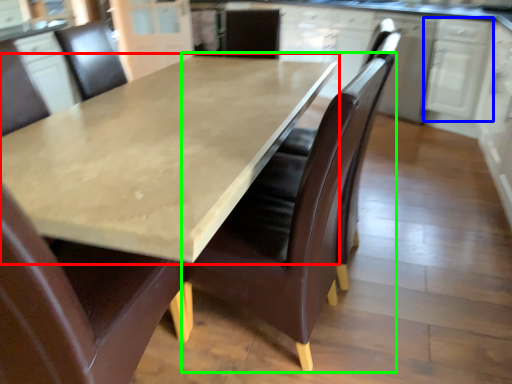
Question: Which object is positioned farthest from countertop (highlighted by a red box)? Select from cabinetry (highlighted by a blue box) and chair (highlighted by a green box).

Choices:
 (A) cabinetry
 (B) chair

Answer: (A)